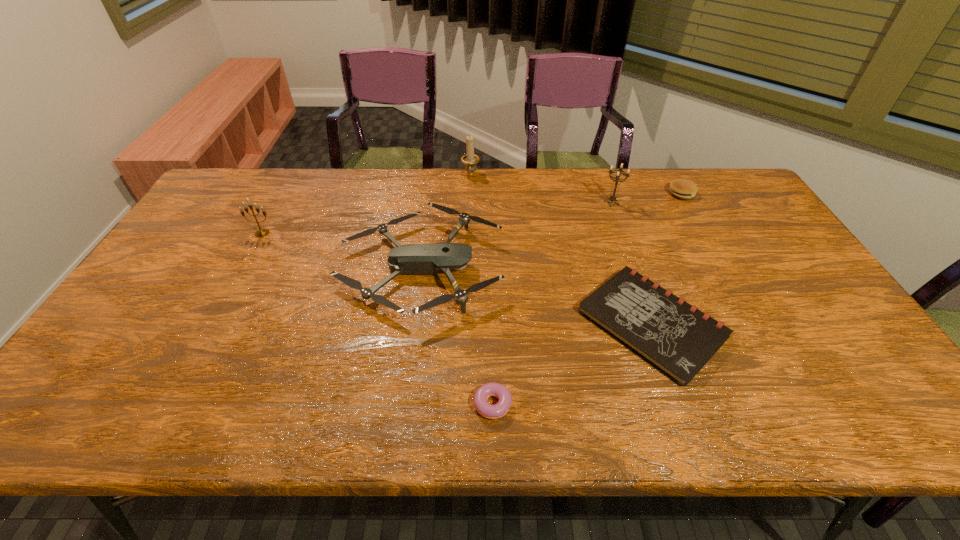
What are the coordinates of `vacant space that satisfies the following two spatial constraints: 1. on the handle side of the farthest candelabrum; 2. with a camera mounted on the front of the drone` in the screenshot? It's located at (468, 268).

The width and height of the screenshot is (960, 540). Find the location of `free location that satisfies the following two spatial constraints: 1. on the handle side of the second candelabrum from right to left; 2. on the right side of the second nearest candelabrum`. free location that satisfies the following two spatial constraints: 1. on the handle side of the second candelabrum from right to left; 2. on the right side of the second nearest candelabrum is located at coordinates (469, 203).

Where is `vacant space that satisfies the following two spatial constraints: 1. on the handle side of the second candelabrum from left to right; 2. on the right side of the fifth tallest object`? This screenshot has height=540, width=960. vacant space that satisfies the following two spatial constraints: 1. on the handle side of the second candelabrum from left to right; 2. on the right side of the fifth tallest object is located at coordinates (470, 193).

Where is `free space in the image that satisfies the following two spatial constraints: 1. on the back side of the patty; 2. on the left side of the second nearest candelabrum`? This screenshot has width=960, height=540. free space in the image that satisfies the following two spatial constraints: 1. on the back side of the patty; 2. on the left side of the second nearest candelabrum is located at coordinates (609, 193).